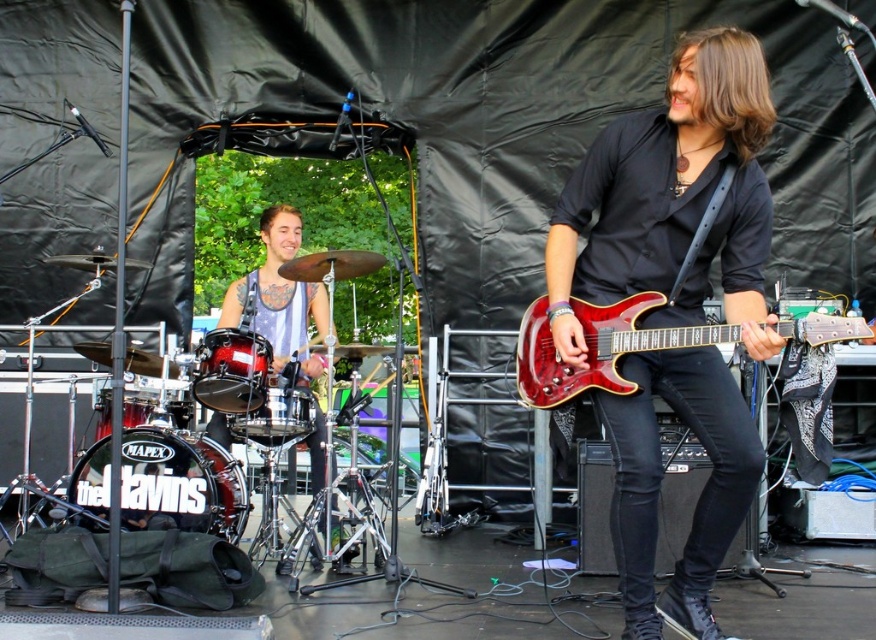
You are a stagehand setting up the music performance. You need to place a protective cover over both the shiny red guitar at center and the glossy wood guitar at center. Which guitar requires a larger cover?

The shiny red guitar at center requires a larger cover because it is larger in size than the glossy wood guitar at center.

You are a stagehand setting up microphones for the shiny red guitar at center and the glossy wood guitar at center. Which guitar should you place the microphone closer to the top of?

The shiny red guitar at center is located above the glossy wood guitar at center, so you should place the microphone closer to the top of the shiny red guitar at center.

You are a photographer at the live music performance. You want to take a closeup photo of the shiny red guitar at center. Where exactly should you point your camera?

You should point your camera at point (673, 200) to capture the shiny red guitar at center.